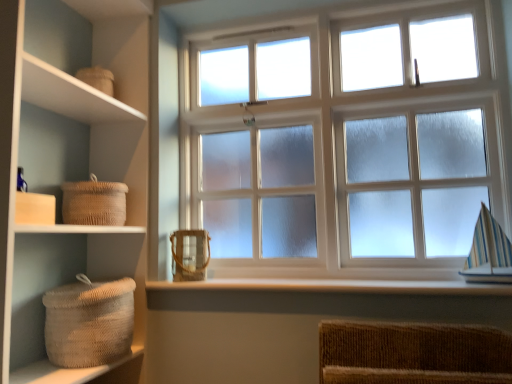
Question: Does woven beige basket at lower left, the 3th basket when ordered from top to bottom, have a greater width compared to frosted glass window at center?

Choices:
 (A) no
 (B) yes

Answer: (B)

Question: From a real-world perspective, is woven beige basket at lower left, the first basket in the bottom-to-top sequence, under frosted glass window at center?

Choices:
 (A) yes
 (B) no

Answer: (A)

Question: Is woven beige basket at lower left, the 3th basket when ordered from top to bottom, positioned with its back to frosted glass window at center?

Choices:
 (A) no
 (B) yes

Answer: (A)

Question: Can you confirm if woven beige basket at lower left, the first basket in the bottom-to-top sequence, is taller than frosted glass window at center?

Choices:
 (A) no
 (B) yes

Answer: (A)

Question: Is woven beige basket at lower left, the 3th basket when ordered from top to bottom, aimed at frosted glass window at center?

Choices:
 (A) no
 (B) yes

Answer: (A)

Question: Looking at the image, does woven beige basket at lower left, the first basket in the bottom-to-top sequence, seem bigger or smaller compared to beige woven basket at left?

Choices:
 (A) big
 (B) small

Answer: (B)

Question: Is woven beige basket at lower left, the first basket in the bottom-to-top sequence, wider or thinner than beige woven basket at left?

Choices:
 (A) wide
 (B) thin

Answer: (B)

Question: Is woven beige basket at lower left, the 3th basket when ordered from top to bottom, to the left or to the right of beige woven basket at left in the image?

Choices:
 (A) right
 (B) left

Answer: (A)

Question: Choose the correct answer: Is woven beige basket at lower left, the first basket in the bottom-to-top sequence, inside beige woven basket at left or outside it?

Choices:
 (A) inside
 (B) outside

Answer: (A)

Question: From a real-world perspective, is beige woven basket at left above or below white smooth wood at lower center?

Choices:
 (A) below
 (B) above

Answer: (B)

Question: Relative to white smooth wood at lower center, is beige woven basket at left in front or behind?

Choices:
 (A) behind
 (B) front

Answer: (B)

Question: Looking at the image, does beige woven basket at left seem bigger or smaller compared to white smooth wood at lower center?

Choices:
 (A) big
 (B) small

Answer: (A)

Question: Choose the correct answer: Is beige woven basket at left inside white smooth wood at lower center or outside it?

Choices:
 (A) outside
 (B) inside

Answer: (A)

Question: Is point (210, 281) positioned closer to the camera than point (98, 206)?

Choices:
 (A) farther
 (B) closer

Answer: (A)

Question: Based on their positions, is white smooth wood at lower center located to the left or right of woven natural fiber basket at left, acting as the 3th basket starting from the bottom?

Choices:
 (A) left
 (B) right

Answer: (B)